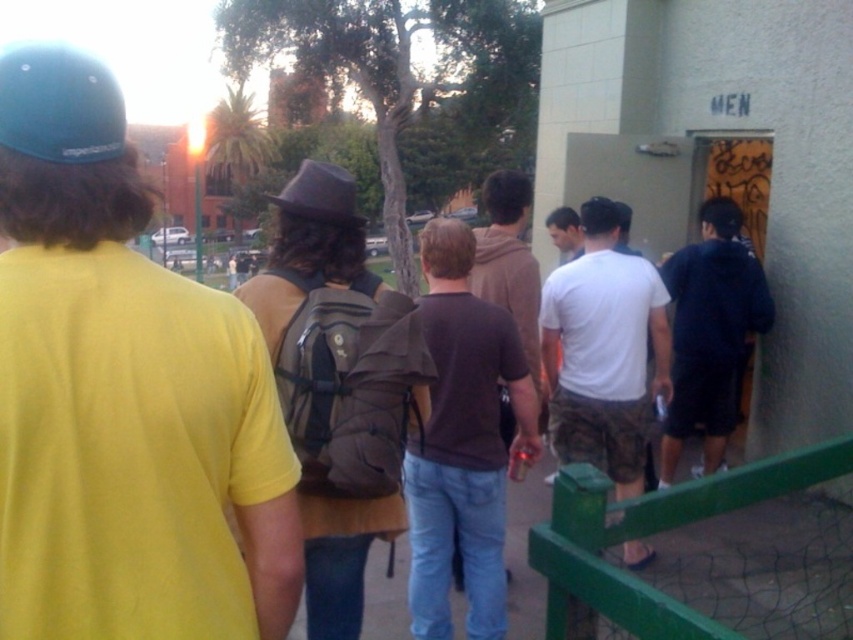
Who is more distant from viewer, (607, 442) or (579, 472)?

The point (607, 442) is behind.

Who is positioned more to the left, white matte t-shirt at center or green painted metal fence at lower right?

From the viewer's perspective, green painted metal fence at lower right appears more on the left side.

You are a GUI agent. You are given a task and a screenshot of the screen. Output one action in this format:
    pyautogui.click(x=<x>, y=<y>)
    Task: Click on the white matte t-shirt at center
    
    Given the screenshot: What is the action you would take?
    pyautogui.click(x=602, y=352)

I want to click on white matte t-shirt at center, so click(x=602, y=352).

Does white matte t-shirt at center lie in front of dark blue hoodie at center?

Yes, it is in front of dark blue hoodie at center.

Who is positioned more to the left, white matte t-shirt at center or dark blue hoodie at center?

white matte t-shirt at center is more to the left.

This screenshot has height=640, width=853. What do you see at coordinates (602, 352) in the screenshot?
I see `white matte t-shirt at center` at bounding box center [602, 352].

I want to click on white matte t-shirt at center, so click(602, 352).

Is brown matte shirt at center further to the viewer compared to white matte t-shirt at center?

No, it is in front of white matte t-shirt at center.

Between brown matte shirt at center and white matte t-shirt at center, which one has less height?

white matte t-shirt at center is shorter.

Does point (509, 342) come in front of point (659, 307)?

That is True.

Identify the location of brown matte shirt at center. This screenshot has width=853, height=640. (463, 442).